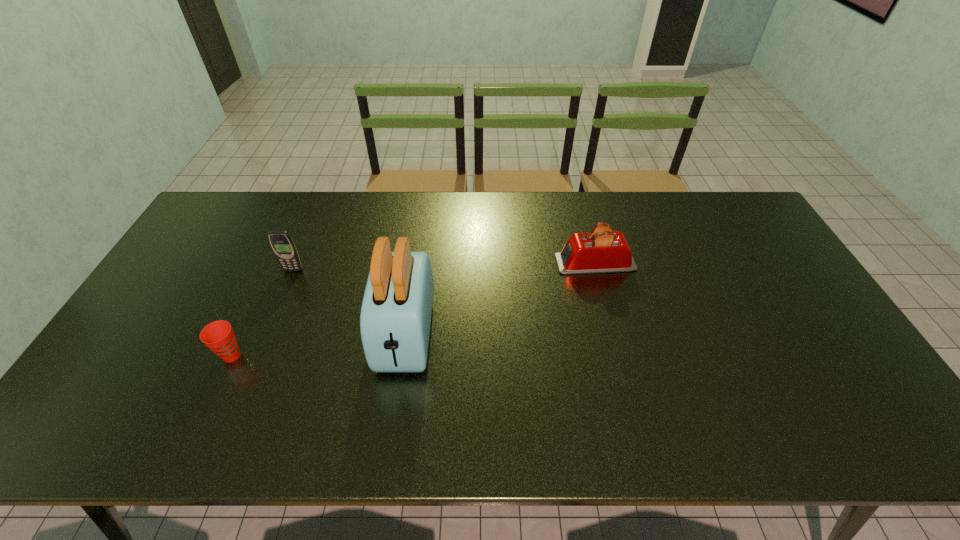
The height and width of the screenshot is (540, 960). In order to click on the left toaster in this screenshot , I will do `click(395, 319)`.

Locate an element on the screen. Image resolution: width=960 pixels, height=540 pixels. the nearer toaster is located at coordinates [395, 319].

Where is `cellular telephone`? This screenshot has height=540, width=960. cellular telephone is located at coordinates (282, 244).

Where is `the farther toaster`? the farther toaster is located at coordinates (602, 250).

At what (x,y) coordinates should I click in order to perform the action: click on the right toaster. Please return your answer as a coordinate pair (x, y). The image size is (960, 540). Looking at the image, I should click on (602, 250).

You are a GUI agent. You are given a task and a screenshot of the screen. Output one action in this format:
    pyautogui.click(x=<x>, y=<y>)
    Task: Click on the cup
    The width and height of the screenshot is (960, 540).
    Given the screenshot: What is the action you would take?
    pyautogui.click(x=219, y=336)

Find the location of a particular element. This screenshot has height=540, width=960. vacant region located on the side of the tallest object with the lever is located at coordinates (392, 429).

This screenshot has height=540, width=960. Identify the location of vacant space situated on the screen of the cellular telephone. (267, 332).

This screenshot has height=540, width=960. Identify the location of free point located 0.380m on the right of the farther toaster. (756, 262).

Locate an element on the screen. The image size is (960, 540). free space located on the left of the cup is located at coordinates (183, 355).